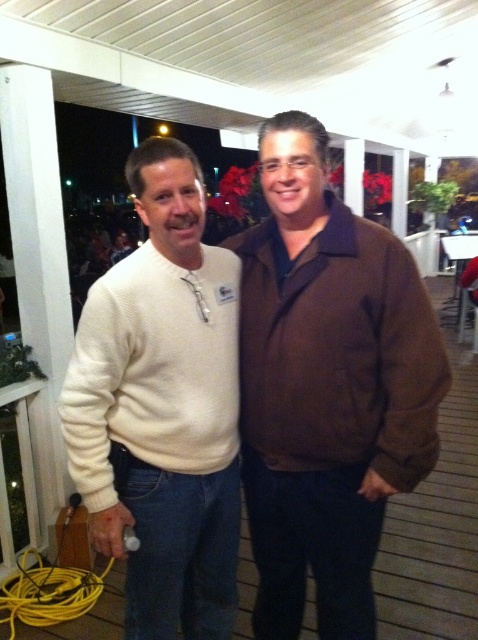
Question: Among these objects, which one is nearest to the camera?

Choices:
 (A) brown corduroy jacket at center
 (B) white sweater at left

Answer: (B)

Question: Does brown corduroy jacket at center have a lesser width compared to white sweater at left?

Choices:
 (A) yes
 (B) no

Answer: (B)

Question: Is brown corduroy jacket at center to the right of white sweater at left from the viewer's perspective?

Choices:
 (A) no
 (B) yes

Answer: (B)

Question: Which object appears closest to the camera in this image?

Choices:
 (A) brown corduroy jacket at center
 (B) white sweater at left

Answer: (B)

Question: Does brown corduroy jacket at center appear under white sweater at left?

Choices:
 (A) no
 (B) yes

Answer: (A)

Question: Which object appears closest to the camera in this image?

Choices:
 (A) white sweater at left
 (B) brown corduroy jacket at center

Answer: (A)